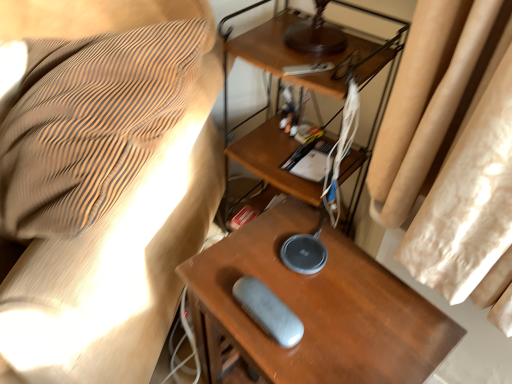
The height and width of the screenshot is (384, 512). Find the location of `vacant space to the left of gray matte speaker at center`. vacant space to the left of gray matte speaker at center is located at coordinates (219, 294).